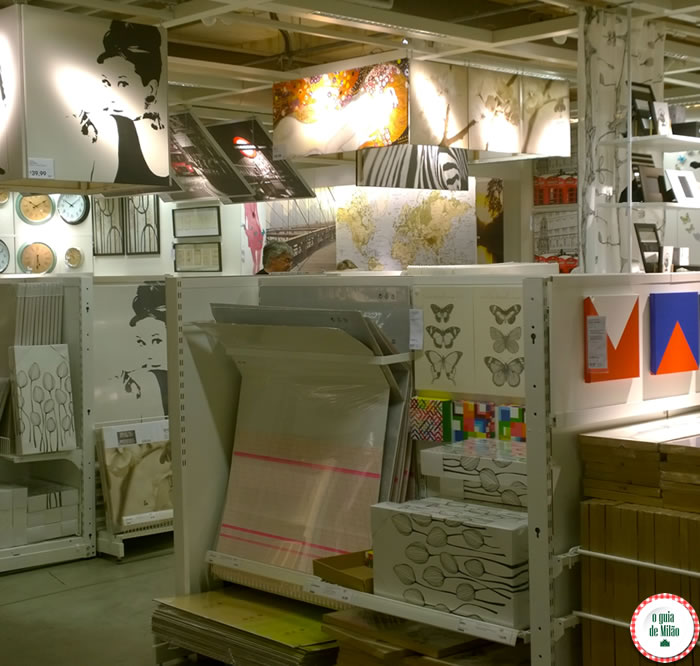
Identify the location of shelving units. (83, 304), (190, 471), (85, 507), (68, 545), (206, 290), (537, 501), (533, 300), (511, 206).